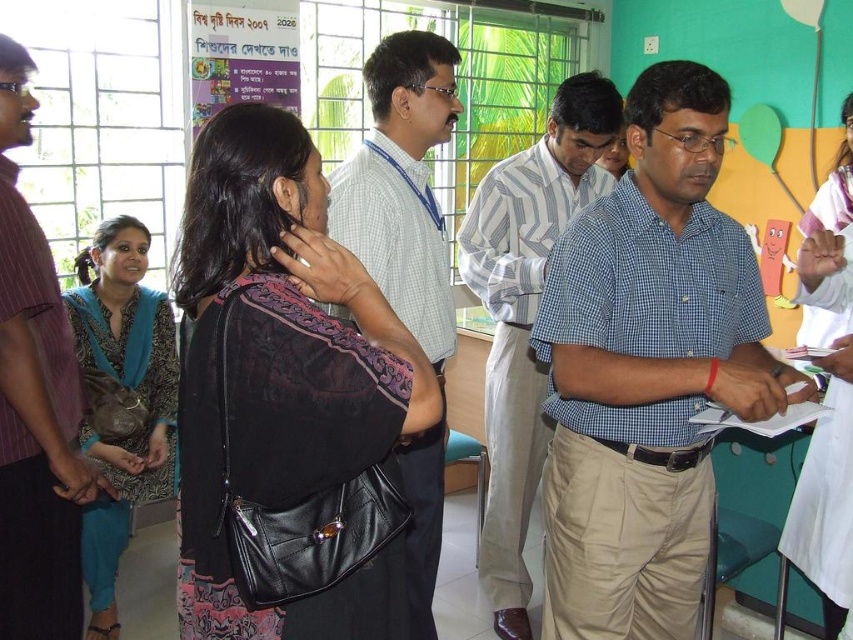
Find the location of a particular element. light blue checkered shirt at center is located at coordinates (526, 314).

Is blue checkered shirt at center behind striped cotton shirt at left?

No, blue checkered shirt at center is in front of striped cotton shirt at left.

Between blue checkered shirt at center and striped cotton shirt at left, which one is positioned lower?

blue checkered shirt at center is below.

What do you see at coordinates (647, 371) in the screenshot? I see `blue checkered shirt at center` at bounding box center [647, 371].

Where is `blue checkered shirt at center`? This screenshot has width=853, height=640. blue checkered shirt at center is located at coordinates (x=647, y=371).

Can you confirm if black leather bag at center is positioned above teal fabric scarf at left?

Yes, black leather bag at center is above teal fabric scarf at left.

Which of these two, black leather bag at center or teal fabric scarf at left, stands taller?

teal fabric scarf at left is taller.

Is point (320, 365) closer to camera compared to point (160, 481)?

That is True.

Find the location of `black leather bag at center`. black leather bag at center is located at coordinates (285, 401).